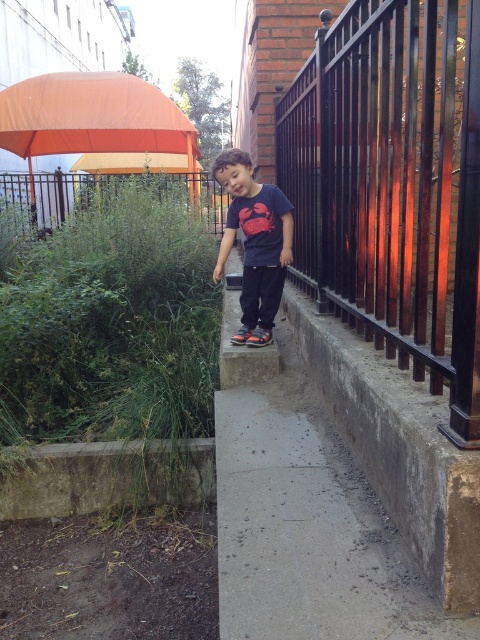
Question: Among these points, which one is nearest to the camera?

Choices:
 (A) (268, 342)
 (B) (57, 138)

Answer: (A)

Question: Is black metal fence at right to the left of dark blue t-shirt at center from the viewer's perspective?

Choices:
 (A) no
 (B) yes

Answer: (A)

Question: Where is orange fabric umbrella at upper left located in relation to dark blue t-shirt at center in the image?

Choices:
 (A) right
 (B) left

Answer: (B)

Question: Considering the real-world distances, which object is closest to the dark blue t-shirt at center?

Choices:
 (A) black metal fence at right
 (B) orange fabric umbrella at upper left

Answer: (A)

Question: Which of the following is the closest to the observer?

Choices:
 (A) (232, 240)
 (B) (130, 122)
 (C) (350, 113)

Answer: (C)

Question: Does orange fabric umbrella at upper left have a greater width compared to dark blue t-shirt at center?

Choices:
 (A) no
 (B) yes

Answer: (B)